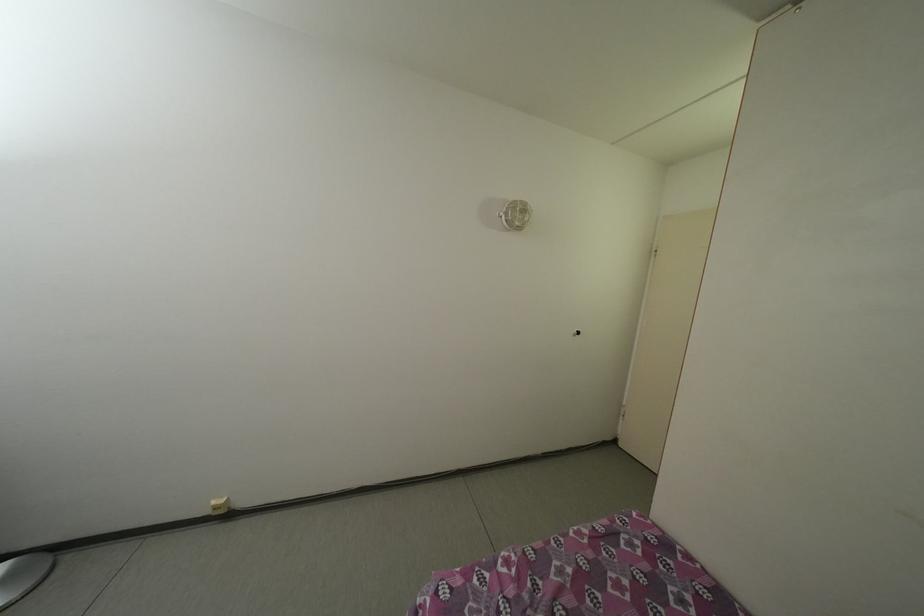
Where is `white electrical outlet`? This screenshot has height=616, width=924. white electrical outlet is located at coordinates (219, 505).